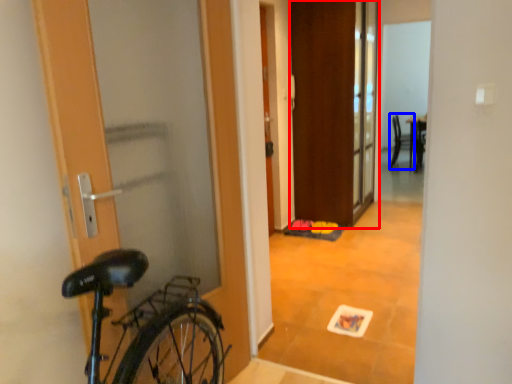
Question: Which of the following is the closest to the observer, door (highlighted by a red box) or chair (highlighted by a blue box)?

Choices:
 (A) door
 (B) chair

Answer: (A)